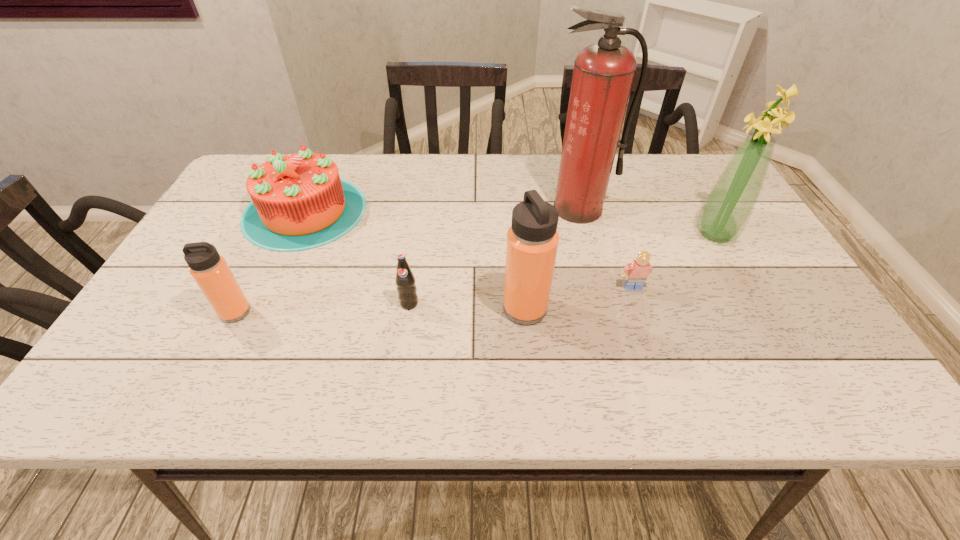
The width and height of the screenshot is (960, 540). Identify the location of free location at the right edge. click(782, 299).

Find the location of a particular element. Image resolution: width=960 pixels, height=540 pixels. free space between the fire extinguisher and the left thermos bottle is located at coordinates (407, 260).

You are a GUI agent. You are given a task and a screenshot of the screen. Output one action in this format:
    pyautogui.click(x=<x>, y=<y>)
    Task: Click on the free space between the left thermos bottle and the fifth object from right to left
    This screenshot has width=960, height=540.
    Given the screenshot: What is the action you would take?
    pyautogui.click(x=323, y=308)

The height and width of the screenshot is (540, 960). I want to click on vacant region between the shorter thermos bottle and the tallest object, so click(407, 260).

Identify the location of vacant point located between the cake and the rightmost object. (510, 222).

Locate an element on the screen. This screenshot has height=540, width=960. vacant space that is in between the shortest object and the rightmost object is located at coordinates [x=674, y=261].

Identify the location of vacant point located between the shorter thermos bottle and the tallest object. The image size is (960, 540). (407, 260).

Locate an element on the screen. This screenshot has width=960, height=540. free spot between the tallest object and the bouquet is located at coordinates (647, 221).

Where is `free point between the cake and the left thermos bottle`? free point between the cake and the left thermos bottle is located at coordinates (270, 261).

Identify which object is the fourth nearest to the cake. Please provide its 2D coordinates. Your answer should be formatted as a tuple, i.e. [(x, y)], where the tuple contains the x and y coordinates of a point satisfying the conditions above.

[(603, 74)]